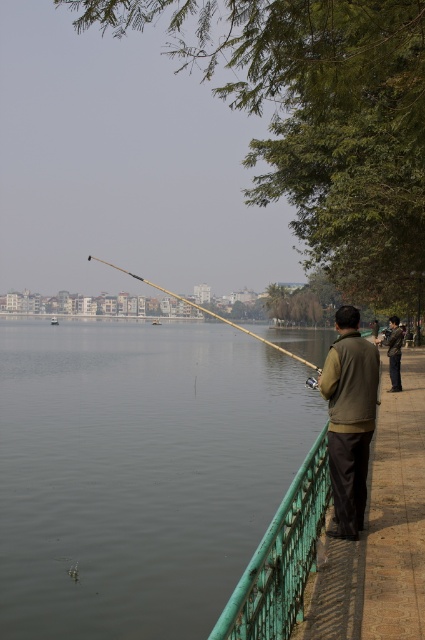
Between clear water at railing right and wooden fishing pole at center, which one appears on the left side from the viewer's perspective?

From the viewer's perspective, wooden fishing pole at center appears more on the left side.

Image resolution: width=425 pixels, height=640 pixels. What are the coordinates of `clear water at railing right` in the screenshot? It's located at (138, 472).

Is point (221, 452) more distant than point (141, 278)?

Yes.

Locate an element on the screen. The image size is (425, 640). clear water at railing right is located at coordinates (138, 472).

Is brown suede jacket at center above wooden fishing pole at center?

Incorrect, brown suede jacket at center is not positioned above wooden fishing pole at center.

Which is in front, point (348, 506) or point (193, 301)?

Positioned in front is point (348, 506).

Is point (357, 472) positioned after point (175, 294)?

That is False.

What are the coordinates of `brown suede jacket at center` in the screenshot? It's located at (350, 419).

Is clear water at railing right behind green painted metal railing at lower center?

Yes, it is.

Which of these two, clear water at railing right or green painted metal railing at lower center, stands shorter?

green painted metal railing at lower center is shorter.

In the scene shown: Who is more distant from viewer, (218, 432) or (320, 445)?

Positioned behind is point (218, 432).

Identify the location of clear water at railing right. This screenshot has width=425, height=640. (138, 472).